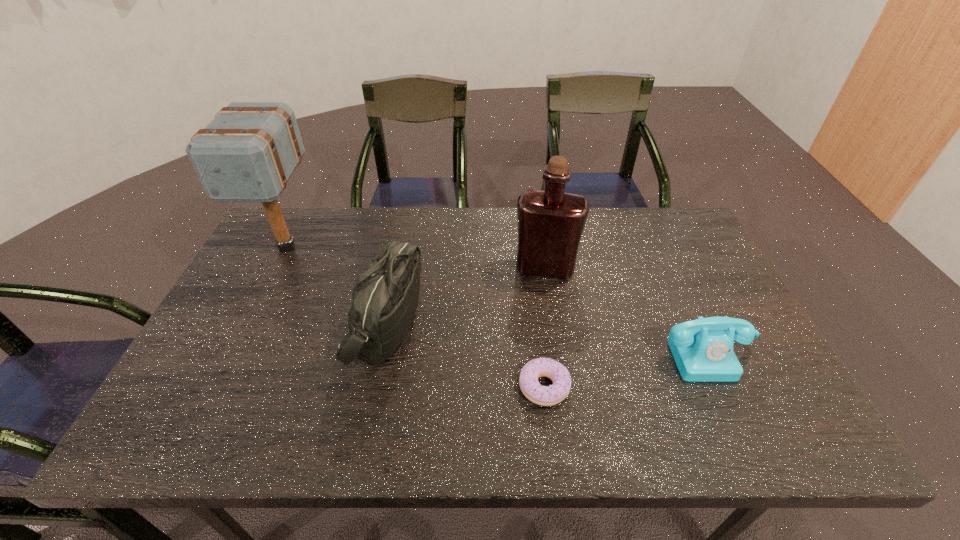
You are a GUI agent. You are given a task and a screenshot of the screen. Output one action in this format:
    pyautogui.click(x=<x>, y=<y>)
    Task: Click on the free space located 0.140m on the dial of the rightmost object
    Image resolution: width=960 pixels, height=540 pixels.
    Given the screenshot: What is the action you would take?
    pyautogui.click(x=747, y=439)

Locate an element on the screen. blank space located on the left of the shortest object is located at coordinates (358, 387).

The width and height of the screenshot is (960, 540). In order to click on object that is at the far edge in this screenshot , I will do `click(248, 152)`.

You are a GUI agent. You are given a task and a screenshot of the screen. Output one action in this format:
    pyautogui.click(x=<x>, y=<y>)
    Task: Click on the object that is at the near edge
    The width and height of the screenshot is (960, 540).
    Given the screenshot: What is the action you would take?
    pyautogui.click(x=553, y=394)

At what (x,y) coordinates should I click in order to perform the action: click on object that is positioned at the left edge. Please return your answer as a coordinate pair (x, y). Looking at the image, I should click on (248, 152).

Identify the location of object that is positioned at the right edge. [x=703, y=351].

The height and width of the screenshot is (540, 960). What are the coordinates of `object positioned at the far left corner` in the screenshot? It's located at (248, 152).

Locate an element on the screen. The width and height of the screenshot is (960, 540). vacant space at the far edge of the desktop is located at coordinates (468, 246).

Where is `free point at the near edge`? free point at the near edge is located at coordinates coord(414,447).

You are a GUI agent. You are given a task and a screenshot of the screen. Output one action in this format:
    pyautogui.click(x=<x>, y=<y>)
    Task: Click on the vacant space at the left edge of the desktop
    The width and height of the screenshot is (960, 540).
    Given the screenshot: What is the action you would take?
    pyautogui.click(x=230, y=366)